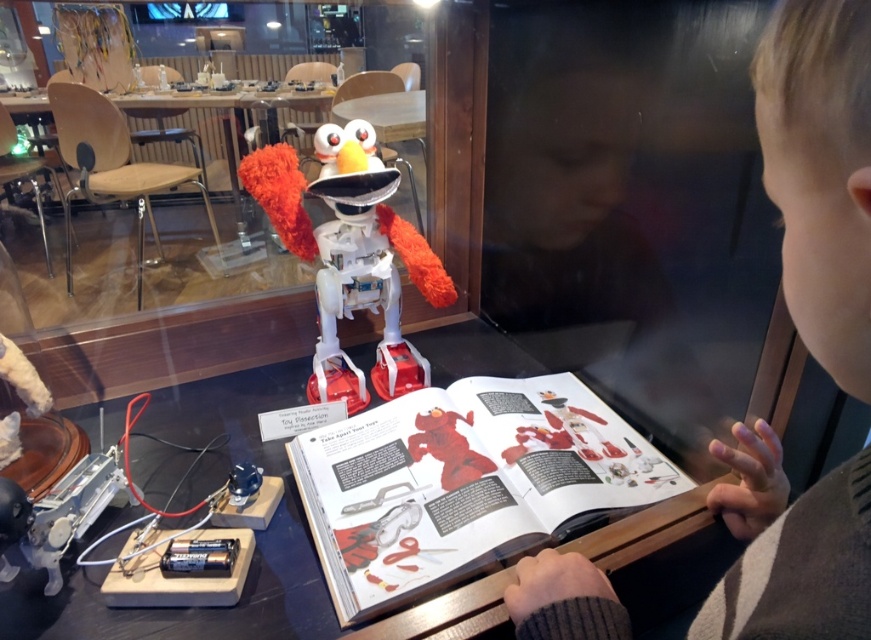
Question: Estimate the real-world distances between objects in this image. Which object is closer to the black plastic table at center?

Choices:
 (A) blonde hair boy at upper right
 (B) fuzzy white robot at center
 (C) matte red book at center

Answer: (C)

Question: Which of the following is the farthest from the observer?

Choices:
 (A) (282, 448)
 (B) (323, 276)
 (C) (628, 458)

Answer: (B)

Question: Which point is farther to the camera?

Choices:
 (A) fuzzy white robot at center
 (B) blonde hair boy at upper right
 (C) black plastic table at center

Answer: (A)

Question: Is blonde hair boy at upper right to the right of fuzzy white robot at center from the viewer's perspective?

Choices:
 (A) yes
 (B) no

Answer: (A)

Question: Is blonde hair boy at upper right to the left of matte red book at center from the viewer's perspective?

Choices:
 (A) yes
 (B) no

Answer: (B)

Question: Is blonde hair boy at upper right positioned behind fuzzy white robot at center?

Choices:
 (A) no
 (B) yes

Answer: (A)